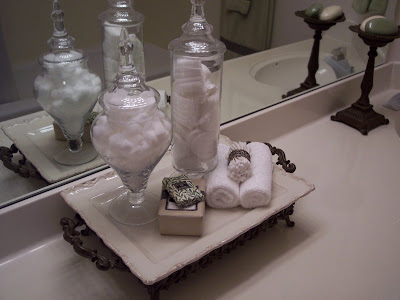
Find the location of a particular element. The image size is (400, 300). ceramic tray with metal stand and metal handles is located at coordinates (118, 250).